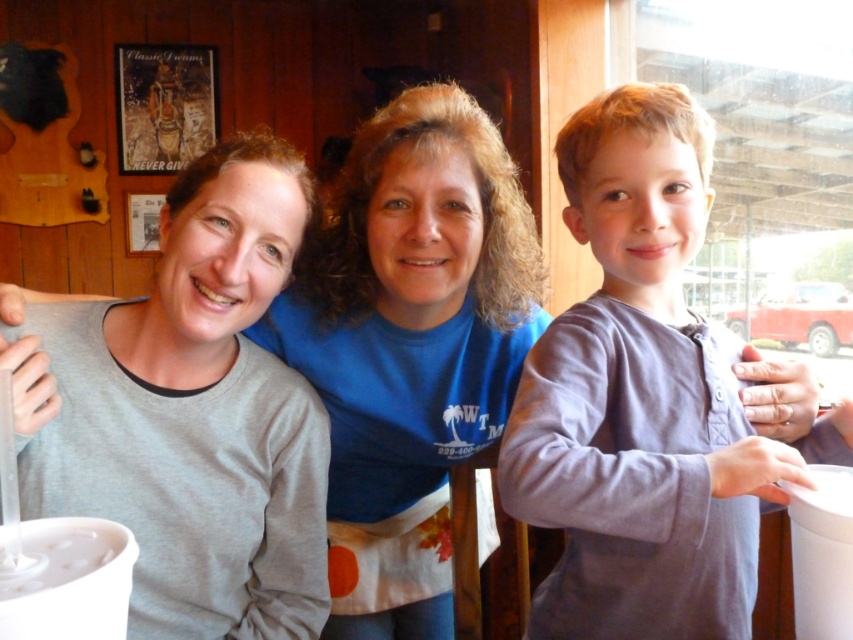
You are a photographer standing 1 meter away from the two people wearing the gray cotton shirt at center and the blue cotton shirt at center. You want to take a photo that includes both of them in the frame without moving either. Given that your camera has a maximum horizontal field of view of 1.5 meters, will you be able to capture both in the same photo?

The gray cotton shirt at center and blue cotton shirt at center are 24.72 centimeters apart from each other. Since the camera has a maximum horizontal field of view of 1.5 meters, which is much larger than the distance between them, you can capture both in the same photo.

You are standing in the room and want to greet the person wearing the gray cotton shirt at center. Which direction should you move relative to the blue cotton shirt at center?

The gray cotton shirt at center is to the right of the blue cotton shirt at center, so you should move to the right side of the blue cotton shirt at center to greet the person wearing the gray cotton shirt at center.

You are trying to decide which shirt to wear for a casual day out. Both the gray cotton shirt at center and the blue cotton shirt at center are available. If you prefer a smaller size, which one should you choose?

The gray cotton shirt at center has a smaller size compared to the blue cotton shirt at center, so you should choose the gray cotton shirt at center.